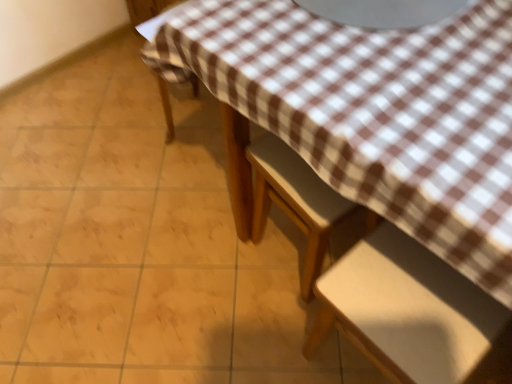
Identify the location of free space on the front side of wooden chair at center, which is the second chair in bottom-to-top order. The height and width of the screenshot is (384, 512). (274, 333).